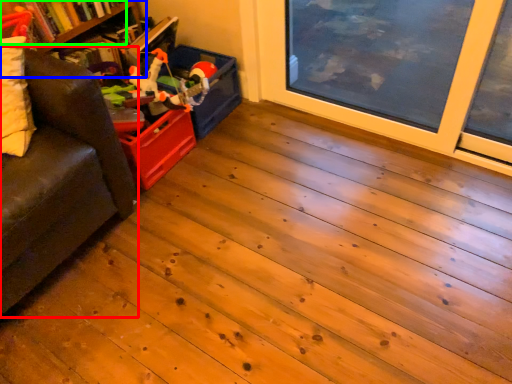
Question: Based on their relative distances, which object is nearer to studio couch (highlighted by a red box)? Choose from bookshelf (highlighted by a blue box) and book (highlighted by a green box).

Choices:
 (A) bookshelf
 (B) book

Answer: (B)